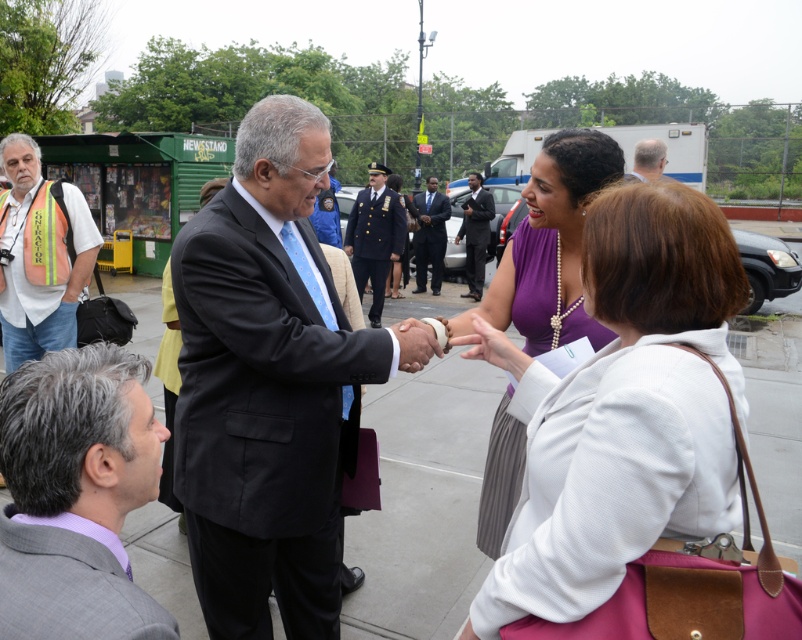
You are a photographer trying to capture a photo of both the matte black suit at center and the dark blue uniform at center in the same frame. Your camera has a maximum focus range that can only capture objects within 5 meters of each other. Can you fit both subjects into a single focused shot?

The distance between the matte black suit at center and the dark blue uniform at center is 6.34 meters, which exceeds the camera maximum focus range of 5 meters. Therefore, you cannot capture both subjects in a single focused shot.

You are a photographer at a social event and want to ensure both the purple satin dress at center and the gray hair at center are clearly visible in your photo. Given their sizes, which one should you focus on to ensure proper framing?

The purple satin dress at center is larger in size than the gray hair at center, so focusing on the purple satin dress at center will ensure proper framing as it occupies more space in the scene.

You are a photographer standing at the edge of the sidewalk. You want to take a photo of both the purple satin dress at center and the dark blue uniform at center. The minimum distance between the two subjects for your camera to focus on both clearly is 5 meters. Can you capture both in focus at this distance?

The purple satin dress at center is 6.26 meters away from dark blue uniform at center. Since the required minimum distance is 5 meters, the 6.26 meters distance allows both subjects to be in focus.